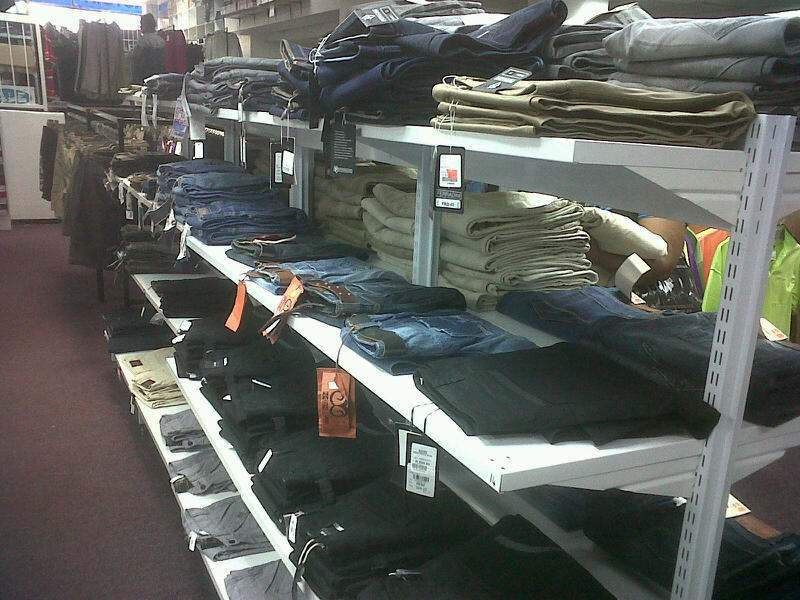
In order to click on shelves of clothing are diagonal from lower right to upper left in photo in this screenshot , I will do `click(392, 165)`.